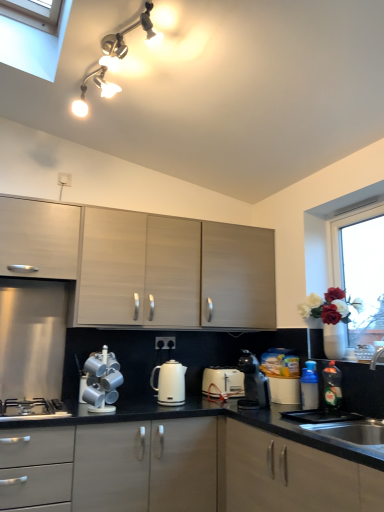
At what (x,y) coordinates should I click in order to perform the action: click on vacant area to the right of white glossy electric kettle at center, which is the 1th kitchen appliance in left-to-right order. Please return your answer as a coordinate pair (x, y). Looking at the image, I should click on (197, 408).